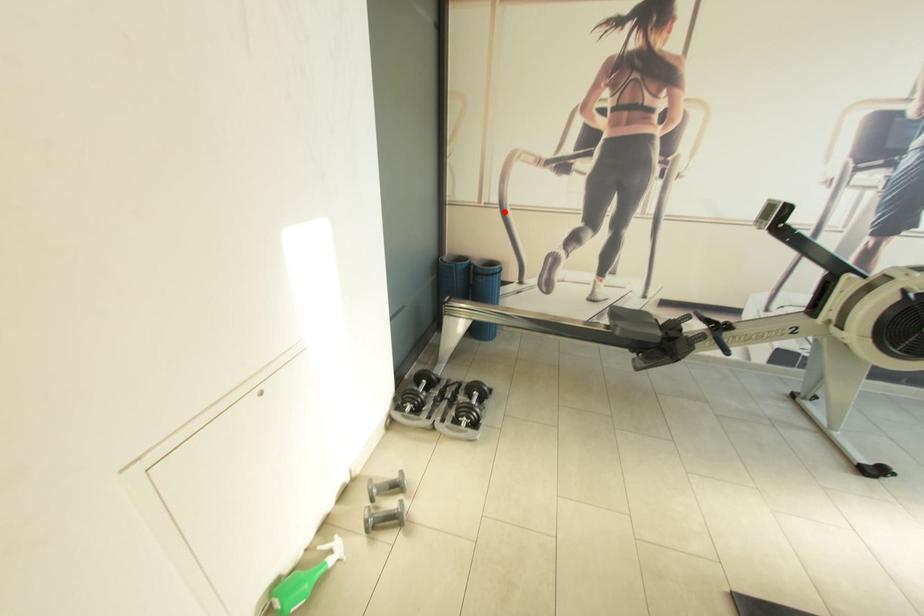
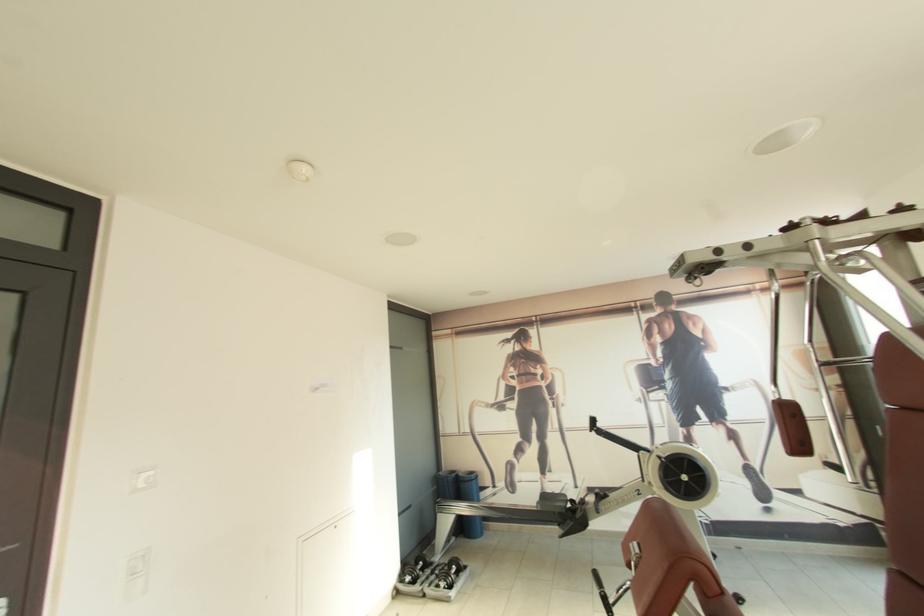
Locate, in the second image, the point that corresponds to the highlighted location in the first image.

(476, 438)